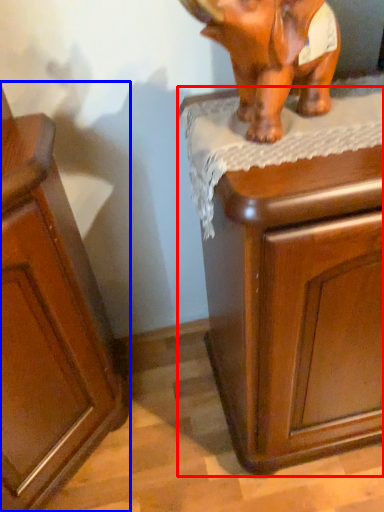
Question: Which of the following is the closest to the observer, chest of drawers (highlighted by a red box) or cabinetry (highlighted by a blue box)?

Choices:
 (A) chest of drawers
 (B) cabinetry

Answer: (B)